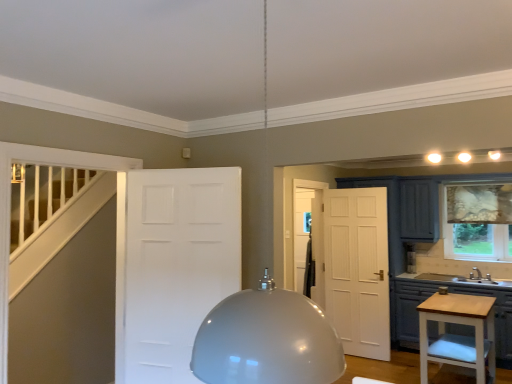
Question: From the image's perspective, relative to matte gray cabinets at lower right, is white matte door at center above or below?

Choices:
 (A) above
 (B) below

Answer: (A)

Question: Considering the relative positions of white matte door at center and matte gray cabinets at lower right in the image provided, is white matte door at center to the left or to the right of matte gray cabinets at lower right?

Choices:
 (A) left
 (B) right

Answer: (A)

Question: Which object is positioned farthest from the white matte door at center?

Choices:
 (A) light wood vanity at lower right
 (B) matte gray cabinets at lower right
 (C) patterned fabric curtain at right

Answer: (C)

Question: Which of these objects is positioned farthest from the light wood vanity at lower right?

Choices:
 (A) patterned fabric curtain at right
 (B) white matte door at center
 (C) matte gray cabinets at lower right

Answer: (B)